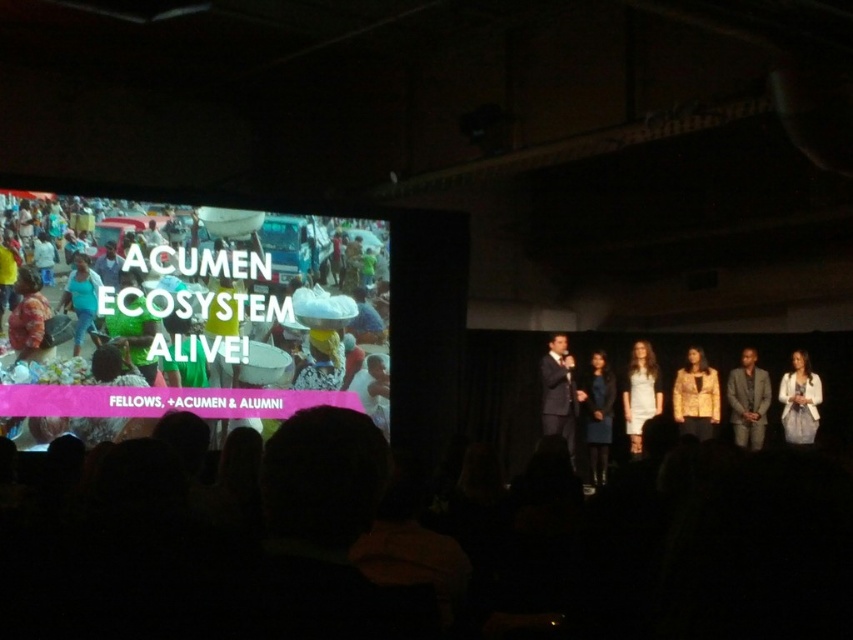
Question: Is matte black suit at center to the right of white satin dress at center from the viewer's perspective?

Choices:
 (A) no
 (B) yes

Answer: (A)

Question: Which point is farther to the camera?

Choices:
 (A) matte blue shirt at center
 (B) white textured jacket at right

Answer: (B)

Question: Which object is closer to the camera taking this photo?

Choices:
 (A) dark blue fabric dress at center
 (B) gray textured suit at center
 (C) white textured jacket at right

Answer: (A)

Question: Is matte black suit at center closer to the viewer compared to white satin dress at center?

Choices:
 (A) no
 (B) yes

Answer: (B)

Question: Is gray textured suit at center thinner than white textured jacket at right?

Choices:
 (A) yes
 (B) no

Answer: (B)

Question: Which point is farther from the camera taking this photo?

Choices:
 (A) (606, 472)
 (B) (695, 362)
 (C) (84, 310)

Answer: (B)